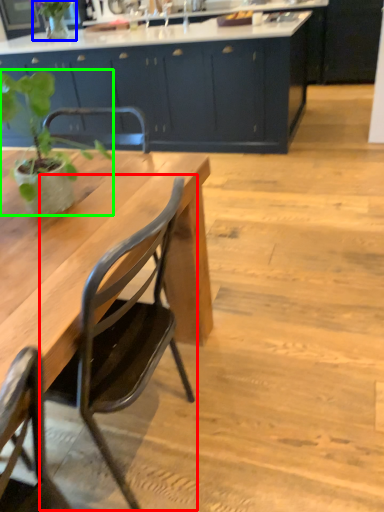
Question: Which object is positioned farthest from chair (highlighted by a red box)? Select from plant (highlighted by a blue box) and houseplant (highlighted by a green box).

Choices:
 (A) plant
 (B) houseplant

Answer: (A)